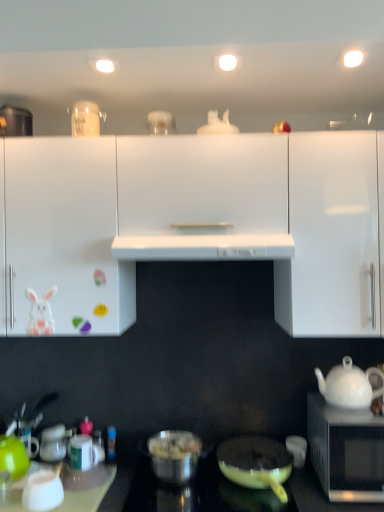
Measure the distance between point (165, 456) and camera.

They are 1.59 meters apart.

The image size is (384, 512). I want to click on shiny metallic pot at center, which is the 1th pot/pan from left to right, so click(174, 455).

What do you see at coordinates (13, 457) in the screenshot? I see `green matte coffee cup at lower left, which ranks as the first coffee cup in left-to-right order` at bounding box center [13, 457].

Locate an element on the screen. Image resolution: width=384 pixels, height=512 pixels. white glossy coffee cup at lower left, which ranks as the second coffee cup in left-to-right order is located at coordinates (43, 490).

Locate an element on the screen. Image resolution: width=384 pixels, height=512 pixels. matte yellow pan at lower center, the 1th pot/pan positioned from the right is located at coordinates (256, 463).

What are the coordinates of `white glossy cabinet at left, the 3th cabinetry positioned from the right` in the screenshot? It's located at (64, 239).

The image size is (384, 512). Find the location of `shiny metallic pot at center, which is the 1th pot/pan from left to right`. shiny metallic pot at center, which is the 1th pot/pan from left to right is located at coordinates (174, 455).

Is metallic silver pan at center aimed at white glossy rabbit at left?

No, metallic silver pan at center is not oriented towards white glossy rabbit at left.

Considering the sizes of objects metallic silver pan at center and white glossy rabbit at left in the image provided, who is taller, metallic silver pan at center or white glossy rabbit at left?

metallic silver pan at center.

From the image's perspective, is metallic silver pan at center located above or below white glossy rabbit at left?

metallic silver pan at center is situated lower than white glossy rabbit at left in the image.

How much distance is there between metallic silver pan at center and white glossy rabbit at left?

A distance of 30.71 inches exists between metallic silver pan at center and white glossy rabbit at left.

Is black matte microwave at lower right facing towards green matte coffee cup at lower left, which ranks as the first coffee cup in left-to-right order?

No, black matte microwave at lower right is not turned towards green matte coffee cup at lower left, which ranks as the first coffee cup in left-to-right order.

This screenshot has height=512, width=384. I want to click on microwave oven in front of the green matte coffee cup at lower left, which is counted as the fourth coffee cup, starting from the right, so click(x=346, y=451).

From the image's perspective, is black matte microwave at lower right above or below green matte coffee cup at lower left, which ranks as the first coffee cup in left-to-right order?

black matte microwave at lower right is situated higher than green matte coffee cup at lower left, which ranks as the first coffee cup in left-to-right order, in the image.

Considering the sizes of white glossy cabinet at center, acting as the 2th cabinetry starting from the right, and white glossy cabinet at left, which is the 1th cabinetry in left-to-right order, in the image, is white glossy cabinet at center, acting as the 2th cabinetry starting from the right, wider or thinner than white glossy cabinet at left, which is the 1th cabinetry in left-to-right order,?

Clearly, white glossy cabinet at center, acting as the 2th cabinetry starting from the right, has more width compared to white glossy cabinet at left, which is the 1th cabinetry in left-to-right order.

Looking at this image, is the position of white glossy cabinet at center, the second cabinetry when ordered from left to right, less distant than that of white glossy cabinet at left, which is the 1th cabinetry in left-to-right order?

Yes, it is in front of white glossy cabinet at left, which is the 1th cabinetry in left-to-right order.

Considering the relative sizes of white glossy cabinet at center, acting as the 2th cabinetry starting from the right, and white glossy cabinet at left, the 3th cabinetry positioned from the right, in the image provided, is white glossy cabinet at center, acting as the 2th cabinetry starting from the right, taller than white glossy cabinet at left, the 3th cabinetry positioned from the right,?

No.

Considering the relative sizes of white glossy cabinet at center, the second cabinetry when ordered from left to right, and white glossy cabinet at left, the 3th cabinetry positioned from the right, in the image provided, is white glossy cabinet at center, the second cabinetry when ordered from left to right, bigger than white glossy cabinet at left, the 3th cabinetry positioned from the right,?

Incorrect, white glossy cabinet at center, the second cabinetry when ordered from left to right, is not larger than white glossy cabinet at left, the 3th cabinetry positioned from the right.

From the image's perspective, is white glossy coffee cup at lower left, which is the 3th coffee cup in right-to-left order, above metallic silver pan at center?

Yes, from the image's perspective, white glossy coffee cup at lower left, which is the 3th coffee cup in right-to-left order, is over metallic silver pan at center.

Is white glossy coffee cup at lower left, which is the 3th coffee cup in right-to-left order, facing towards metallic silver pan at center?

No, white glossy coffee cup at lower left, which is the 3th coffee cup in right-to-left order, does not turn towards metallic silver pan at center.

From a real-world perspective, count 1st coffee cups upward from the metallic silver pan at center and point to it. Please provide its 2D coordinates.

[(43, 490)]

Considering the sizes of objects white glossy coffee cup at lower left, which ranks as the second coffee cup in left-to-right order, and metallic silver pan at center in the image provided, who is wider, white glossy coffee cup at lower left, which ranks as the second coffee cup in left-to-right order, or metallic silver pan at center?

Wider between the two is metallic silver pan at center.

Is white glossy coffee cup at lower left, which ranks as the second coffee cup in left-to-right order, positioned with its back to black matte microwave at lower right?

No.

Looking at this image, who is taller, white glossy coffee cup at lower left, which is the 3th coffee cup in right-to-left order, or black matte microwave at lower right?

With more height is black matte microwave at lower right.

Considering the positions of objects white glossy coffee cup at lower left, which ranks as the second coffee cup in left-to-right order, and black matte microwave at lower right in the image provided, who is more to the left, white glossy coffee cup at lower left, which ranks as the second coffee cup in left-to-right order, or black matte microwave at lower right?

white glossy coffee cup at lower left, which ranks as the second coffee cup in left-to-right order, is more to the left.

Locate an element on the screen. animal below the white glossy exhaust hood at center (from the image's perspective) is located at coordinates (40, 313).

Is white glossy rabbit at left taller than white glossy exhaust hood at center?

Indeed, white glossy rabbit at left has a greater height compared to white glossy exhaust hood at center.

In the scene shown: Would you say white glossy rabbit at left is outside white glossy exhaust hood at center?

Yes.

Looking at this image, how far apart are white glossy rabbit at left and white glossy exhaust hood at center?

50.33 centimeters.

Where is `pot/pan that is the 1st object directly below the white glossy rabbit at left (from a real-world perspective)`? pot/pan that is the 1st object directly below the white glossy rabbit at left (from a real-world perspective) is located at coordinates (174, 455).

Could you tell me if shiny metallic pot at center, the 2th pot/pan when ordered from right to left, is turned towards white glossy rabbit at left?

No, shiny metallic pot at center, the 2th pot/pan when ordered from right to left, does not turn towards white glossy rabbit at left.

Choose the correct answer: Is shiny metallic pot at center, the 2th pot/pan when ordered from right to left, inside white glossy rabbit at left or outside it?

shiny metallic pot at center, the 2th pot/pan when ordered from right to left, is not inside white glossy rabbit at left, it's outside.

Looking at this image, is shiny metallic pot at center, which is the 1th pot/pan from left to right, far from white glossy rabbit at left?

That's not correct — shiny metallic pot at center, which is the 1th pot/pan from left to right, is a little close to white glossy rabbit at left.

Locate an element on the screen. This screenshot has width=384, height=512. animal lying above the metallic silver pan at center (from the image's perspective) is located at coordinates (40, 313).

Locate an element on the screen. coffee cup that is the 2nd one when counting backward from the black matte microwave at lower right is located at coordinates (13, 457).

Which object lies nearer to the anchor point matte yellow pan at lower center, which ranks as the second pot/pan in left-to-right order, white glossy teapot at right or white glossy cabinet at center, the second cabinetry when ordered from left to right?

white glossy teapot at right is closer to matte yellow pan at lower center, which ranks as the second pot/pan in left-to-right order.

Which object lies nearer to the anchor point white glossy cabinet at center, acting as the 2th cabinetry starting from the right, green matte coffee cup at lower left, which is counted as the 2th coffee cup, starting from the right, or white glossy coffee cup at lower right, which is counted as the 4th coffee cup, starting from the left?

green matte coffee cup at lower left, which is counted as the 2th coffee cup, starting from the right, is closer to white glossy cabinet at center, acting as the 2th cabinetry starting from the right.

Based on their spatial positions, is white glossy teapot at right or white glossy coffee cup at lower right, which is counted as the 4th coffee cup, starting from the left, closer to white glossy exhaust hood at center?

The object closer to white glossy exhaust hood at center is white glossy teapot at right.

Considering their positions, is green matte coffee cup at lower left, which ranks as the first coffee cup in left-to-right order, positioned further to white glossy coffee cup at lower left, which is the 3th coffee cup in right-to-left order, than matte yellow pan at lower center, which ranks as the second pot/pan in left-to-right order?

matte yellow pan at lower center, which ranks as the second pot/pan in left-to-right order, lies further to white glossy coffee cup at lower left, which is the 3th coffee cup in right-to-left order, than the other object.

Estimate the real-world distances between objects in this image. Which object is further from white glossy cabinet at left, the 3th cabinetry positioned from the right, white glossy coffee cup at lower right, which is counted as the 4th coffee cup, starting from the left, or white glossy coffee cup at lower left, which is the 3th coffee cup in right-to-left order?

white glossy coffee cup at lower right, which is counted as the 4th coffee cup, starting from the left, is further to white glossy cabinet at left, the 3th cabinetry positioned from the right.

From the image, which object appears to be farther from green matte coffee cup at lower left, the 3th coffee cup viewed from the left, green matte coffee cup at lower left, which ranks as the first coffee cup in left-to-right order, or white glossy cabinet at center, the second cabinetry when ordered from left to right?

white glossy cabinet at center, the second cabinetry when ordered from left to right, is positioned further to the anchor green matte coffee cup at lower left, the 3th coffee cup viewed from the left.

Considering their positions, is white glossy teapot at right positioned further to white glossy rabbit at left than black matte microwave at lower right?

black matte microwave at lower right lies further to white glossy rabbit at left than the other object.

From the picture: Estimate the real-world distances between objects in this image. Which object is closer to shiny metallic pot at center, which is the 1th pot/pan from left to right, white glossy cabinet at center, acting as the 2th cabinetry starting from the right, or white glossy coffee cup at lower left, which ranks as the second coffee cup in left-to-right order?

white glossy coffee cup at lower left, which ranks as the second coffee cup in left-to-right order, is closer to shiny metallic pot at center, which is the 1th pot/pan from left to right.

Identify the location of microwave oven between white glossy cabinet at center, the second cabinetry when ordered from left to right, and green matte coffee cup at lower left, which is counted as the 2th coffee cup, starting from the right, from top to bottom. (346, 451).

This screenshot has height=512, width=384. I want to click on microwave oven between white glossy teapot at right and white glossy coffee cup at lower right, which is counted as the 4th coffee cup, starting from the left, in the up-down direction, so click(346, 451).

Where is `cabinetry located between green matte coffee cup at lower left, which is counted as the 2th coffee cup, starting from the right, and white glossy teapot at right in the left-right direction`? cabinetry located between green matte coffee cup at lower left, which is counted as the 2th coffee cup, starting from the right, and white glossy teapot at right in the left-right direction is located at coordinates (202, 198).

At what (x,y) coordinates should I click in order to perform the action: click on microwave oven between white glossy cabinet at center, the second cabinetry when ordered from left to right, and white glossy coffee cup at lower right, the first coffee cup in the right-to-left sequence, in the vertical direction. Please return your answer as a coordinate pair (x, y). Looking at the image, I should click on (346, 451).